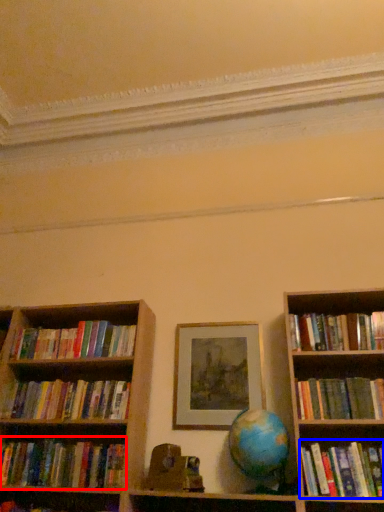
Question: Which point is closer to the camera, book (highlighted by a red box) or book (highlighted by a blue box)?

Choices:
 (A) book
 (B) book

Answer: (B)